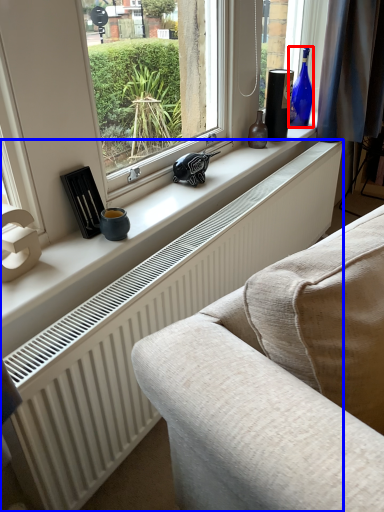
Question: Which object is closer to the camera taking this photo, bottle (highlighted by a red box) or radiator (highlighted by a blue box)?

Choices:
 (A) bottle
 (B) radiator

Answer: (B)